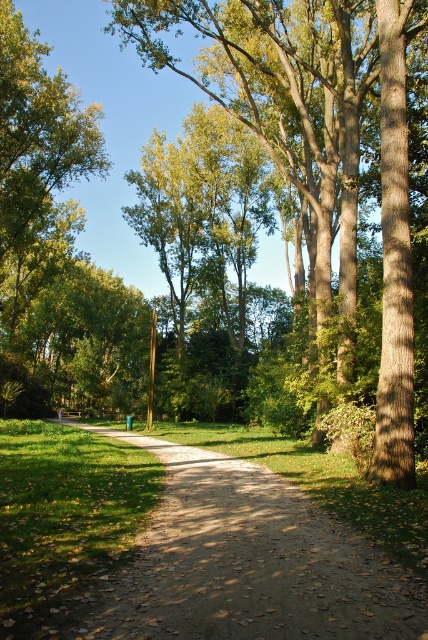
Question: Can you confirm if brown textured tree at center is smaller than dirt/gravel path at center?

Choices:
 (A) no
 (B) yes

Answer: (A)

Question: Which of the following is the closest to the observer?

Choices:
 (A) brown textured tree at center
 (B) dirt/gravel path at center

Answer: (B)

Question: Among these objects, which one is farthest from the camera?

Choices:
 (A) brown textured tree at center
 (B) dirt/gravel path at center

Answer: (A)

Question: Can you confirm if brown textured tree at center is wider than dirt/gravel path at center?

Choices:
 (A) yes
 (B) no

Answer: (A)

Question: Which point is farther to the camera?

Choices:
 (A) brown textured tree at center
 (B) dirt/gravel path at center

Answer: (A)

Question: Is brown textured tree at center positioned in front of dirt/gravel path at center?

Choices:
 (A) yes
 (B) no

Answer: (B)